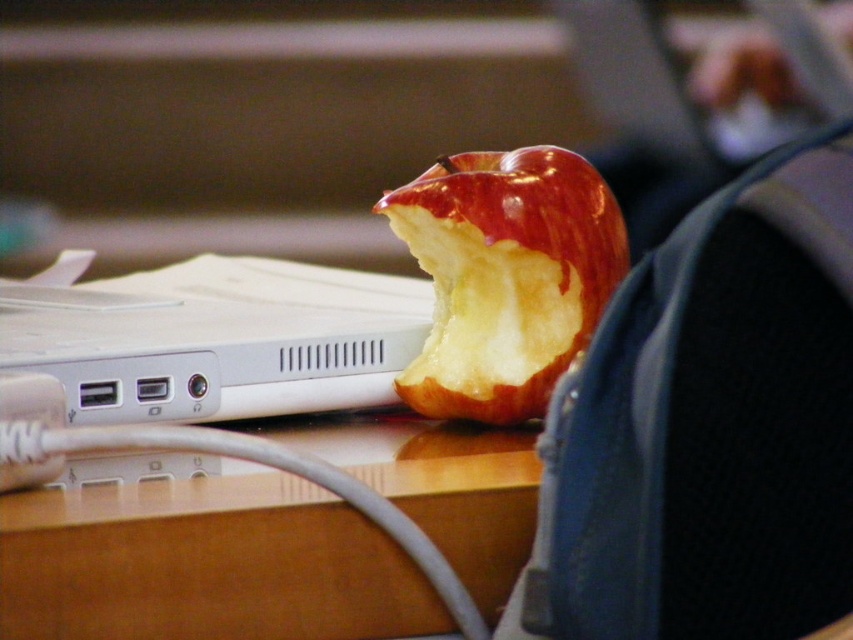
Question: Which of the following is the farthest from the observer?

Choices:
 (A) white plastic laptop at center
 (B) shiny red apple at center

Answer: (B)

Question: Considering the relative positions of white plastic laptop at center and shiny red apple at center in the image provided, where is white plastic laptop at center located with respect to shiny red apple at center?

Choices:
 (A) below
 (B) above

Answer: (A)

Question: Which point is closer to the camera?

Choices:
 (A) (283, 545)
 (B) (525, 257)

Answer: (A)

Question: Does white plastic laptop at center have a smaller size compared to shiny red apple at center?

Choices:
 (A) no
 (B) yes

Answer: (A)

Question: Does brown wood table at center have a lesser width compared to white plastic laptop at center?

Choices:
 (A) yes
 (B) no

Answer: (A)

Question: Which object appears closest to the camera in this image?

Choices:
 (A) white plastic laptop at center
 (B) brown wood table at center
 (C) shiny red apple at center

Answer: (B)